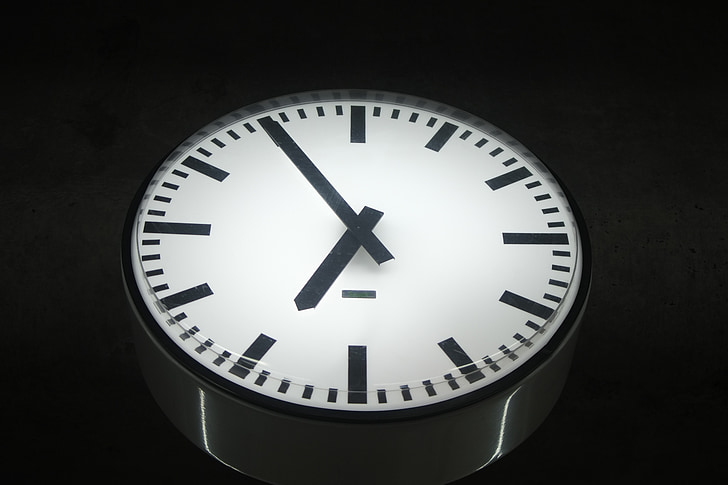
Where is `clock face`? This screenshot has height=485, width=728. clock face is located at coordinates (515, 266), (357, 358), (414, 385), (154, 244), (266, 206), (413, 174), (364, 292).